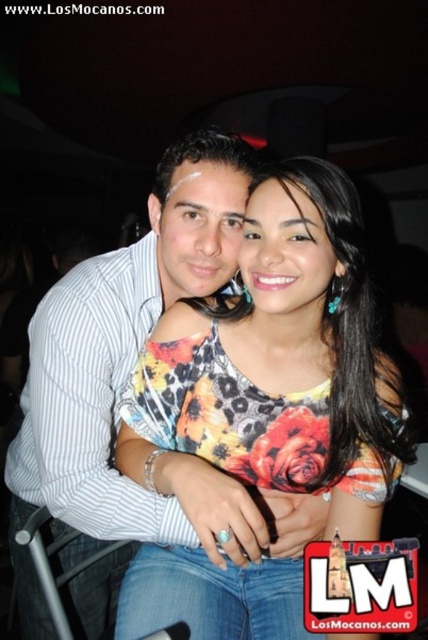
Between floral printed top at center and white striped shirt at center, which one appears on the left side from the viewer's perspective?

From the viewer's perspective, white striped shirt at center appears more on the left side.

Does point (371, 481) lie in front of point (157, 182)?

That is True.

Where is `floral printed top at center`? floral printed top at center is located at coordinates click(279, 365).